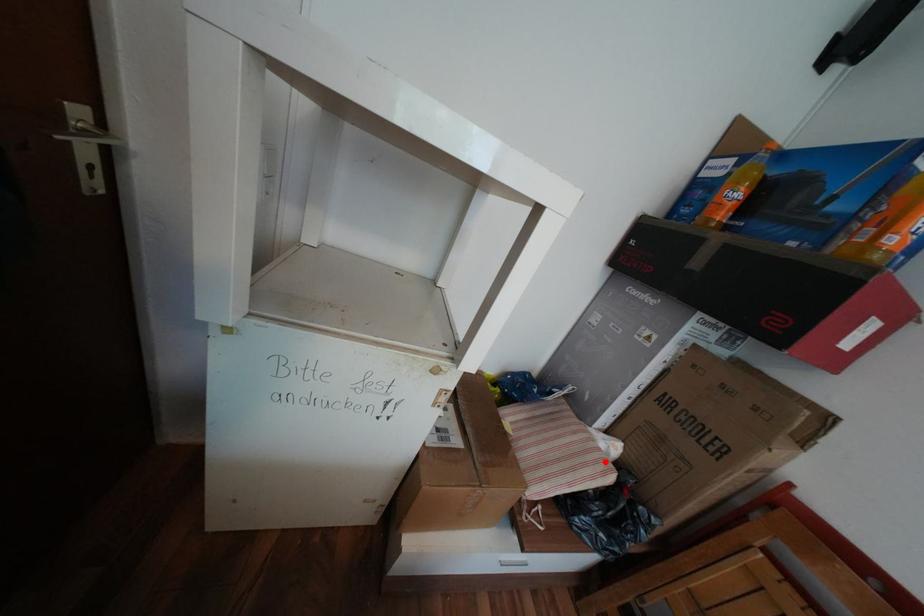
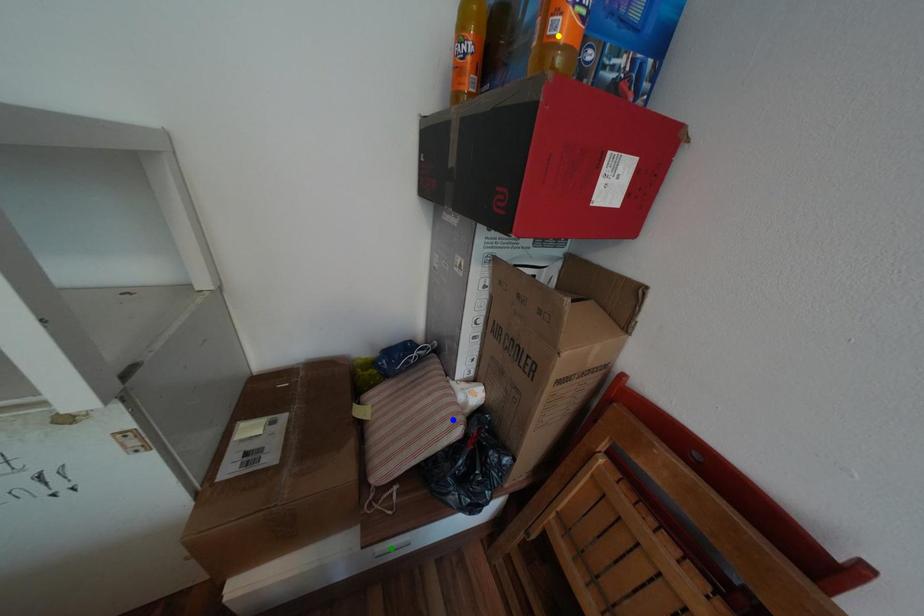
Question: I am providing you with two images of the same scene from different viewpoints. A red point is marked on the first image. You are given multiple points on the second image. Which mark in image 2 goes with the point in image 1?

Choices:
 (A) yellow point
 (B) green point
 (C) blue point

Answer: (C)